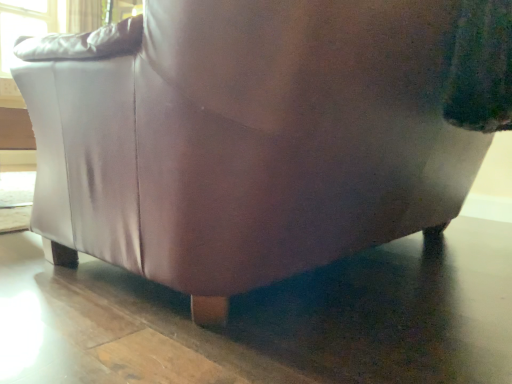
Describe the element at coordinates (23, 24) in the screenshot. I see `transparent glass window at upper left` at that location.

Locate an element on the screen. The image size is (512, 384). transparent glass window at upper left is located at coordinates (23, 24).

Image resolution: width=512 pixels, height=384 pixels. What are the coordinates of `transparent glass window at upper left` in the screenshot? It's located at (23, 24).